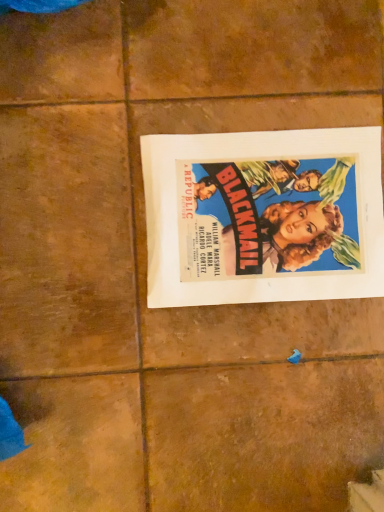
Consider the image. What is the approximate height of vibrant paper poster at center?

1.51 centimeters.

You are a GUI agent. You are given a task and a screenshot of the screen. Output one action in this format:
    pyautogui.click(x=<x>, y=<y>)
    Task: Click on the vibrant paper poster at center
    This screenshot has width=384, height=512.
    Given the screenshot: What is the action you would take?
    pyautogui.click(x=263, y=216)

What do you see at coordinates (263, 216) in the screenshot? I see `vibrant paper poster at center` at bounding box center [263, 216].

What are the coordinates of `vibrant paper poster at center` in the screenshot? It's located at (263, 216).